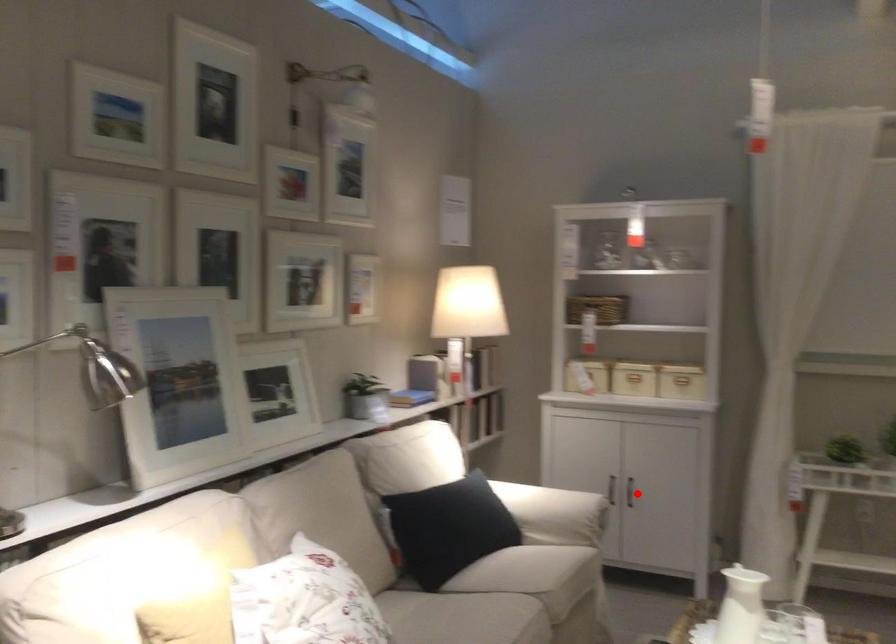
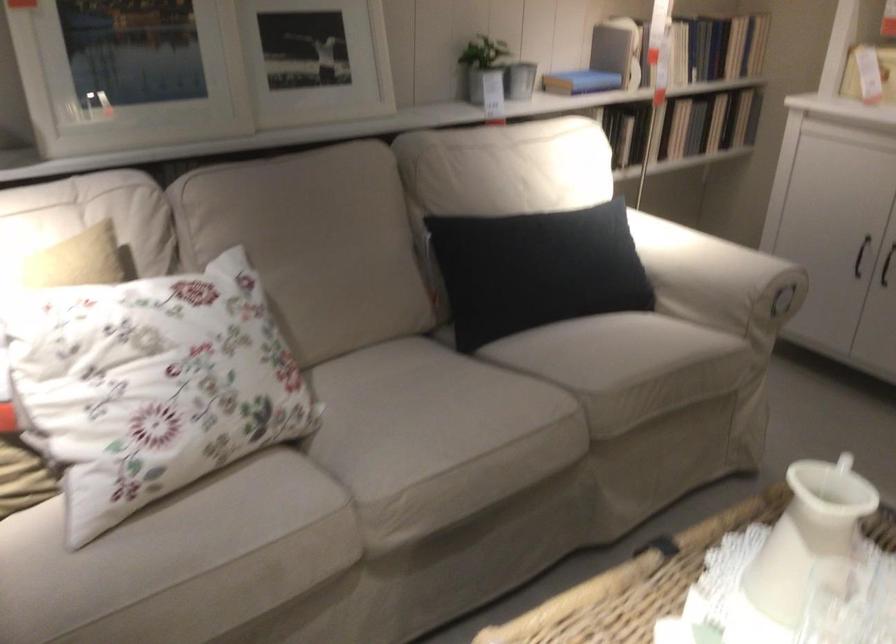
Question: I am providing you with two images of the same scene from different viewpoints. A red point is shown in image1. For the corresponding object point in image2, is it positioned nearer or farther from the camera?

Choices:
 (A) Nearer
 (B) Farther

Answer: (A)